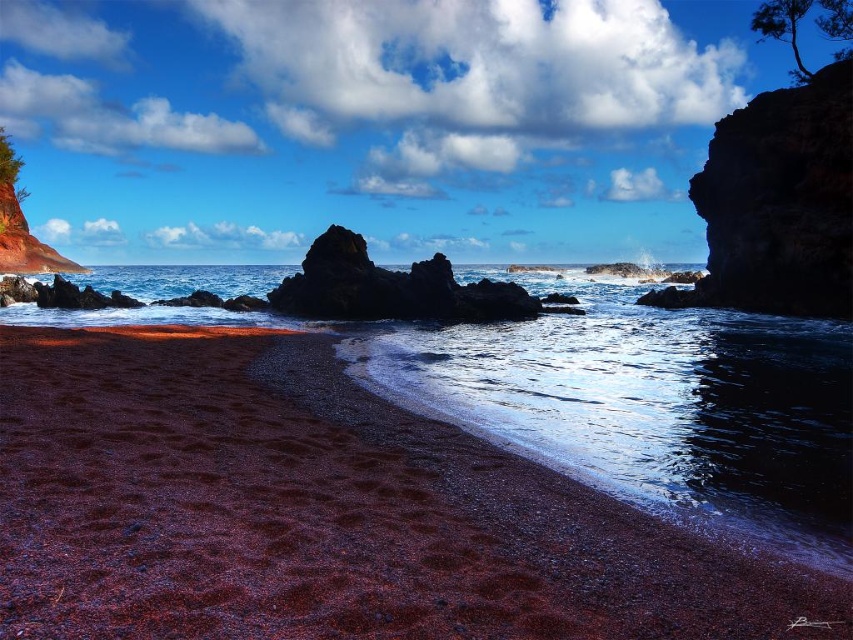
Question: Which point is farther to the camera?

Choices:
 (A) (817, 26)
 (B) (676, 406)
 (C) (0, 164)

Answer: (C)

Question: Can you confirm if smooth dark rock at center is positioned to the right of green rough tree at upper left?

Choices:
 (A) no
 (B) yes

Answer: (B)

Question: Which point is farther to the camera?

Choices:
 (A) (19, 188)
 (B) (511, 292)
 (C) (469, 332)

Answer: (A)

Question: Which object is closer to the camera taking this photo?

Choices:
 (A) green leafy tree at upper right
 (B) glistening water at center
 (C) dark red gravel at lower left
 (D) smooth dark rock at center

Answer: (C)

Question: Can you confirm if glistening water at center is positioned to the right of green rough tree at upper left?

Choices:
 (A) yes
 (B) no

Answer: (A)

Question: Does dark red gravel at lower left have a lesser width compared to green rough tree at upper left?

Choices:
 (A) yes
 (B) no

Answer: (A)